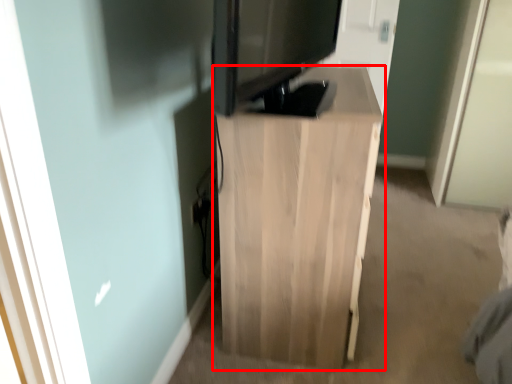
Question: Considering the relative positions of furniture (annotated by the red box) and electronic in the image provided, where is furniture (annotated by the red box) located with respect to the staircase?

Choices:
 (A) left
 (B) right

Answer: (B)